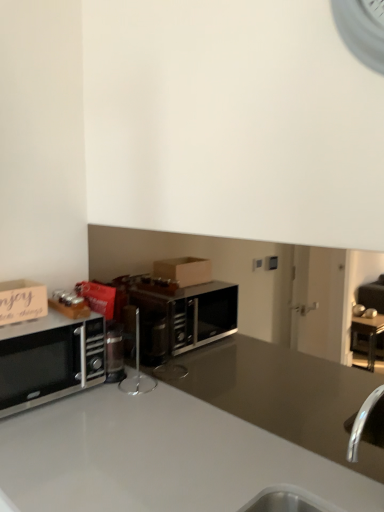
Question: Is satin black microwave at left aimed at wooden sign at left?

Choices:
 (A) yes
 (B) no

Answer: (B)

Question: Can you see satin black microwave at left touching wooden sign at left?

Choices:
 (A) no
 (B) yes

Answer: (A)

Question: Considering the relative positions of satin black microwave at left and wooden sign at left in the image provided, is satin black microwave at left to the left of wooden sign at left from the viewer's perspective?

Choices:
 (A) no
 (B) yes

Answer: (A)

Question: Considering the relative positions of satin black microwave at left and wooden sign at left in the image provided, is satin black microwave at left in front of wooden sign at left?

Choices:
 (A) no
 (B) yes

Answer: (B)

Question: Is wooden sign at left surrounded by satin black microwave at left?

Choices:
 (A) yes
 (B) no

Answer: (B)

Question: Is satin black microwave at left wider than wooden sign at left?

Choices:
 (A) yes
 (B) no

Answer: (A)

Question: Considering the relative sizes of wooden sign at left and satin silver stand at center in the image provided, is wooden sign at left thinner than satin silver stand at center?

Choices:
 (A) no
 (B) yes

Answer: (A)

Question: Is wooden sign at left not inside satin silver stand at center?

Choices:
 (A) yes
 (B) no

Answer: (A)

Question: From a real-world perspective, is wooden sign at left on satin silver stand at center?

Choices:
 (A) no
 (B) yes

Answer: (B)

Question: From the image's perspective, does wooden sign at left appear lower than satin silver stand at center?

Choices:
 (A) no
 (B) yes

Answer: (A)

Question: Is wooden sign at left smaller than satin silver stand at center?

Choices:
 (A) no
 (B) yes

Answer: (A)

Question: From the image's perspective, is wooden sign at left on satin silver stand at center?

Choices:
 (A) no
 (B) yes

Answer: (B)

Question: From a real-world perspective, is satin silver stand at center over satin black microwave at left?

Choices:
 (A) no
 (B) yes

Answer: (B)